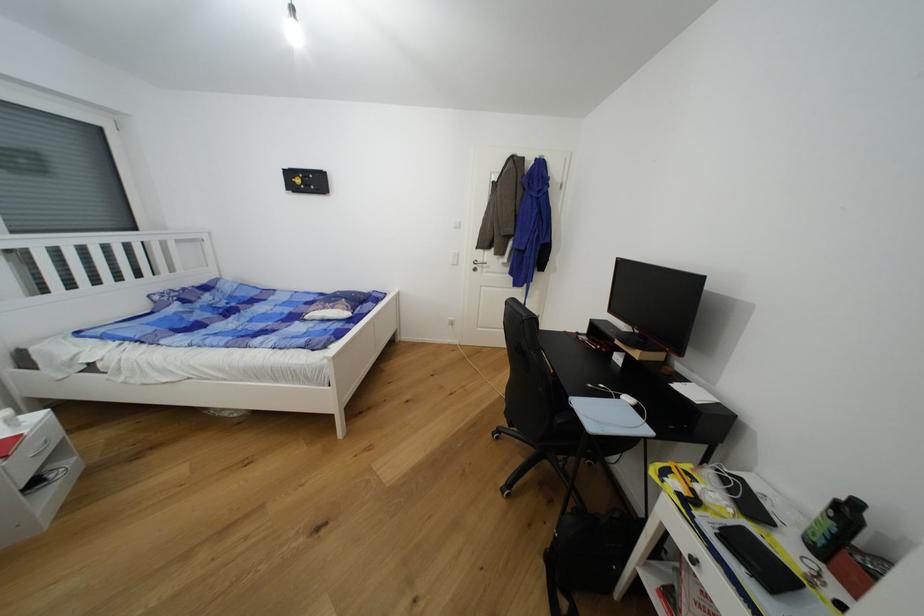
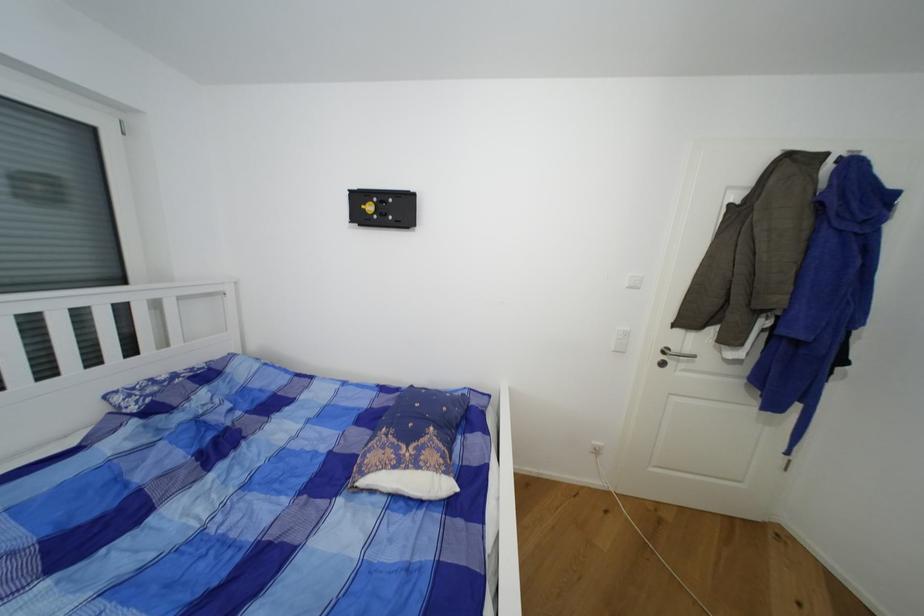
In a continuous first-person perspective shot, in which direction is the camera moving?

The cameraman walked toward left, forward.